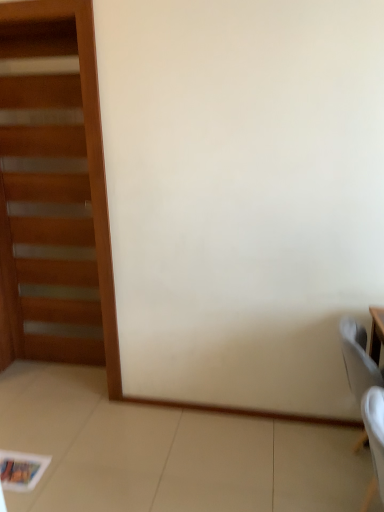
The width and height of the screenshot is (384, 512). Find the location of `wooden stairs at left`. wooden stairs at left is located at coordinates (57, 193).

This screenshot has width=384, height=512. Describe the element at coordinates (57, 193) in the screenshot. I see `wooden stairs at left` at that location.

Measure the distance between point (94, 145) and camera.

The depth of point (94, 145) is 2.09 meters.

Locate an element on the screen. Image resolution: width=384 pixels, height=512 pixels. wooden stairs at left is located at coordinates click(57, 193).